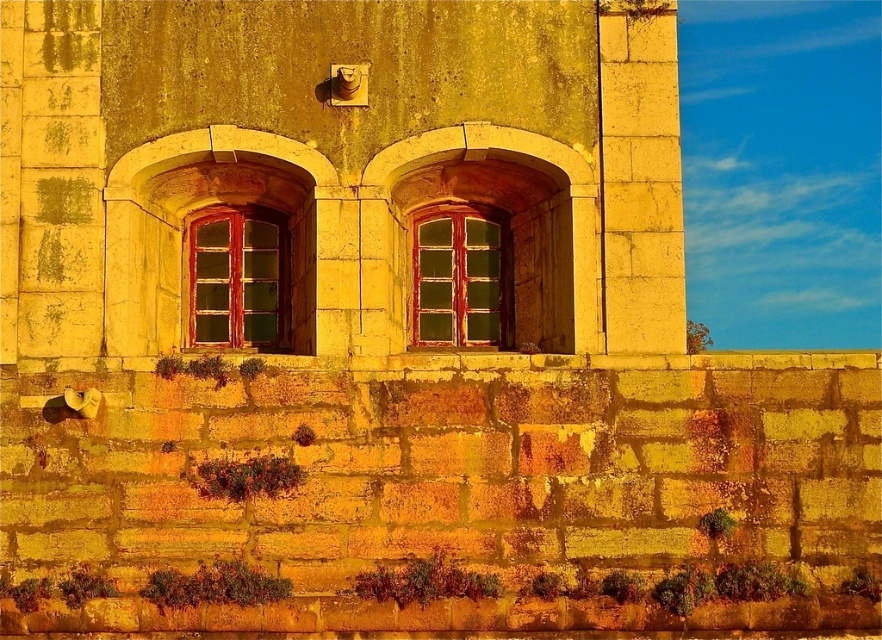
Question: Where is matte red wooden window at center located in relation to green glass window at center in the image?

Choices:
 (A) above
 (B) below

Answer: (B)

Question: Is matte red wooden window at center thinner than green glass window at center?

Choices:
 (A) yes
 (B) no

Answer: (B)

Question: Which of the following is the farthest from the observer?

Choices:
 (A) (226, 227)
 (B) (432, 321)

Answer: (A)

Question: Which of the following is the closest to the observer?

Choices:
 (A) (437, 272)
 (B) (274, 301)

Answer: (B)

Question: Which of the following is the farthest from the observer?

Choices:
 (A) (240, 244)
 (B) (421, 264)

Answer: (B)

Question: Considering the relative positions of matte red wooden window at center and green glass window at center in the image provided, where is matte red wooden window at center located with respect to green glass window at center?

Choices:
 (A) above
 (B) below

Answer: (B)